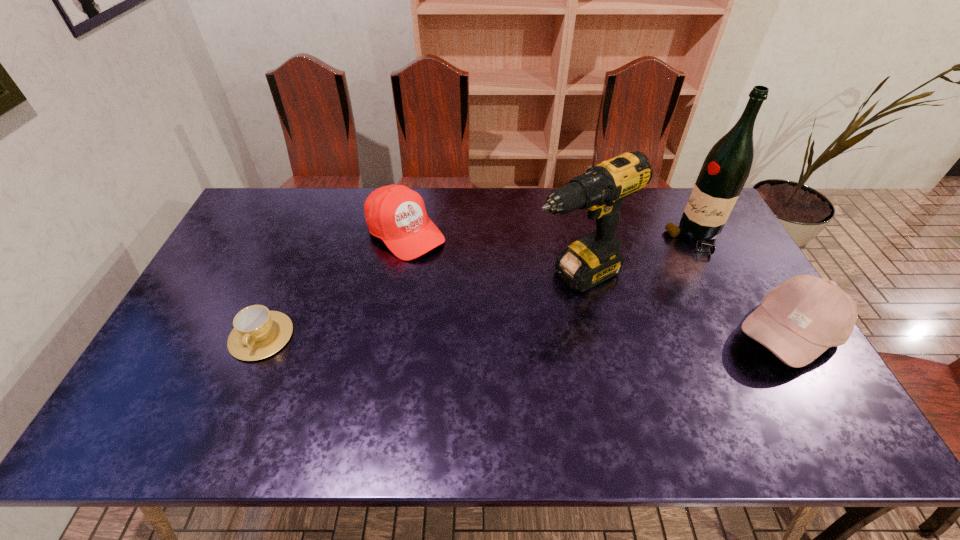
This screenshot has height=540, width=960. I want to click on cup, so click(x=258, y=333).

Locate an element on the screen. the shortest object is located at coordinates (258, 333).

Where is `the right baseball cap`? This screenshot has height=540, width=960. the right baseball cap is located at coordinates (800, 319).

The height and width of the screenshot is (540, 960). Identify the location of the second tallest object. (594, 258).

At what (x,y) coordinates should I click in order to perform the action: click on the third object from right to left. Please return your answer as a coordinate pair (x, y). This screenshot has width=960, height=540. Looking at the image, I should click on (594, 258).

Find the location of a particular element. This screenshot has height=540, width=960. the tallest object is located at coordinates (726, 168).

You are a GUI agent. You are given a task and a screenshot of the screen. Output one action in this format:
    pyautogui.click(x=<x>, y=<y>)
    Task: Click on the left baseball cap
    The width and height of the screenshot is (960, 540).
    Given the screenshot: What is the action you would take?
    pyautogui.click(x=396, y=214)

This screenshot has width=960, height=540. I want to click on the second object from left to right, so click(x=396, y=214).

You are a GUI agent. You are given a task and a screenshot of the screen. Output one action in this format:
    pyautogui.click(x=<x>, y=<y>)
    Task: Click on the vacant point located 0.200m at the tip of the drill
    The height and width of the screenshot is (540, 960).
    Given the screenshot: What is the action you would take?
    pyautogui.click(x=482, y=321)

Where is `vacant space located 0.390m at the tip of the drill`? The image size is (960, 540). vacant space located 0.390m at the tip of the drill is located at coordinates (422, 354).